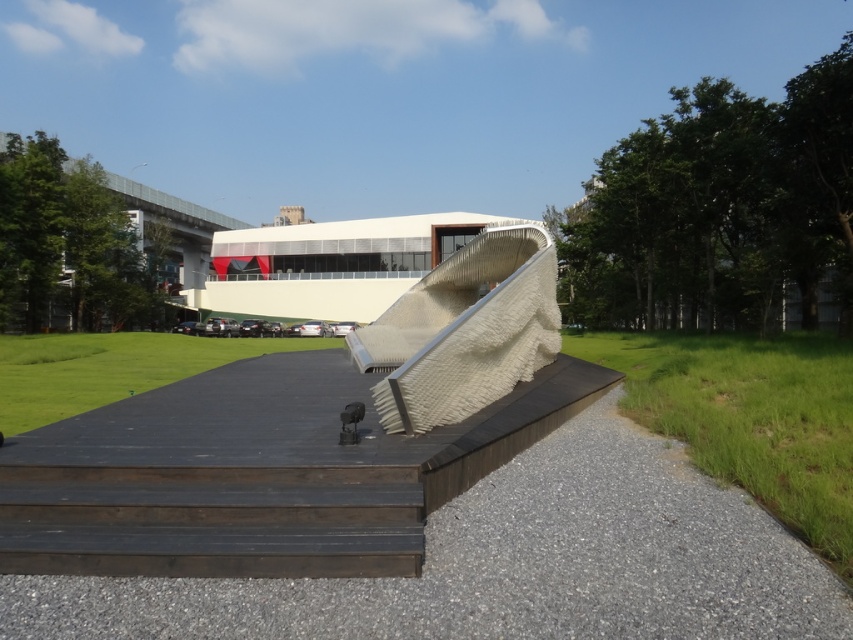
Question: Is gray gravel at lower center positioned before white textured ramp at center?

Choices:
 (A) no
 (B) yes

Answer: (B)

Question: Among these objects, which one is nearest to the camera?

Choices:
 (A) white textured ramp at center
 (B) green grass at lower right
 (C) green grass at center

Answer: (B)

Question: Which point is farther from the camera taking this photo?

Choices:
 (A) (676, 586)
 (B) (126, 332)
 (C) (822, 394)

Answer: (B)

Question: Does gray gravel at lower center appear on the right side of green grass at center?

Choices:
 (A) yes
 (B) no

Answer: (A)

Question: Observing the image, what is the correct spatial positioning of gray gravel at lower center in reference to white textured ramp at center?

Choices:
 (A) left
 (B) right

Answer: (A)

Question: Which point is farther to the camera?

Choices:
 (A) green grass at lower right
 (B) green grass at center
 (C) gray gravel at lower center
 (D) white textured ramp at center

Answer: (B)